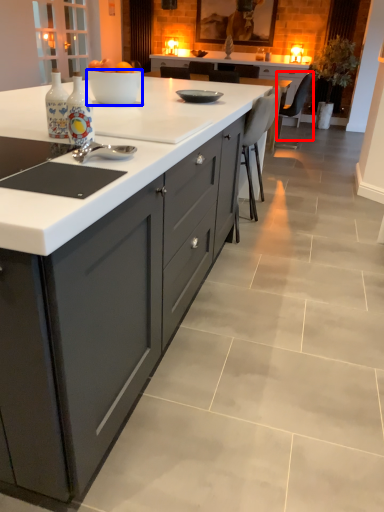
Question: Which object appears closest to the camera in this image, chair (highlighted by a red box) or bowl (highlighted by a blue box)?

Choices:
 (A) chair
 (B) bowl

Answer: (B)